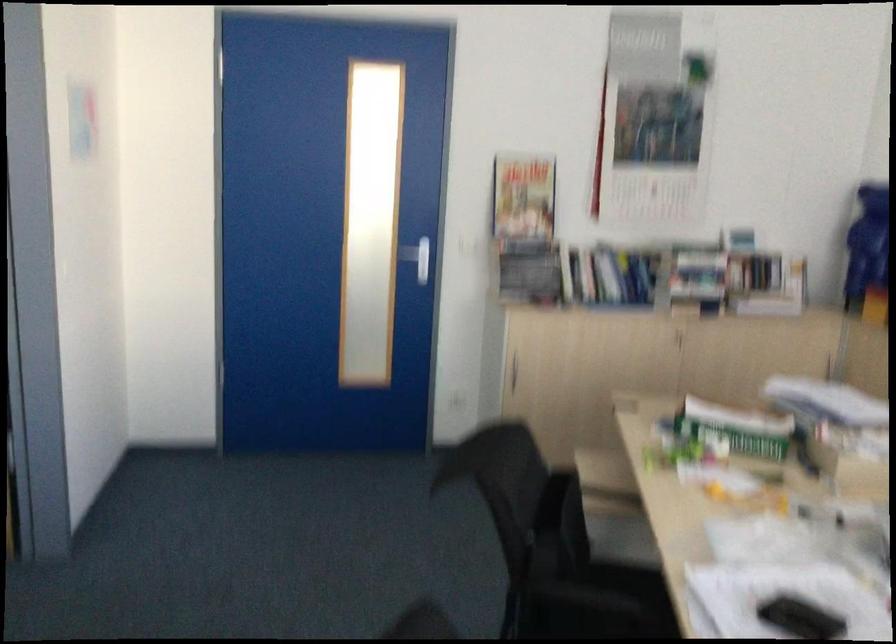
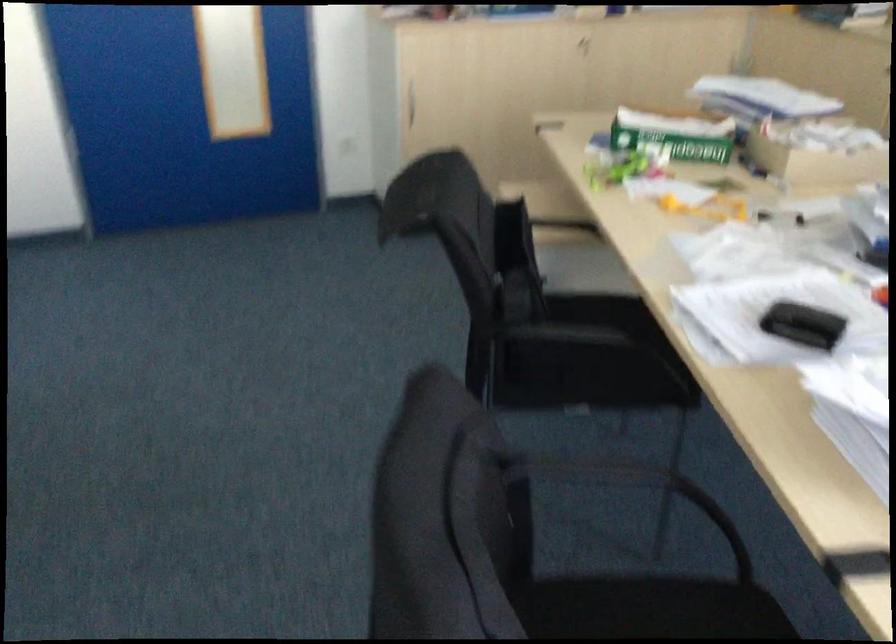
Question: The first image is from the beginning of the video and the second image is from the end. How did the camera likely rotate when shooting the video?

Choices:
 (A) Left
 (B) Right
 (C) Up
 (D) Down

Answer: (D)